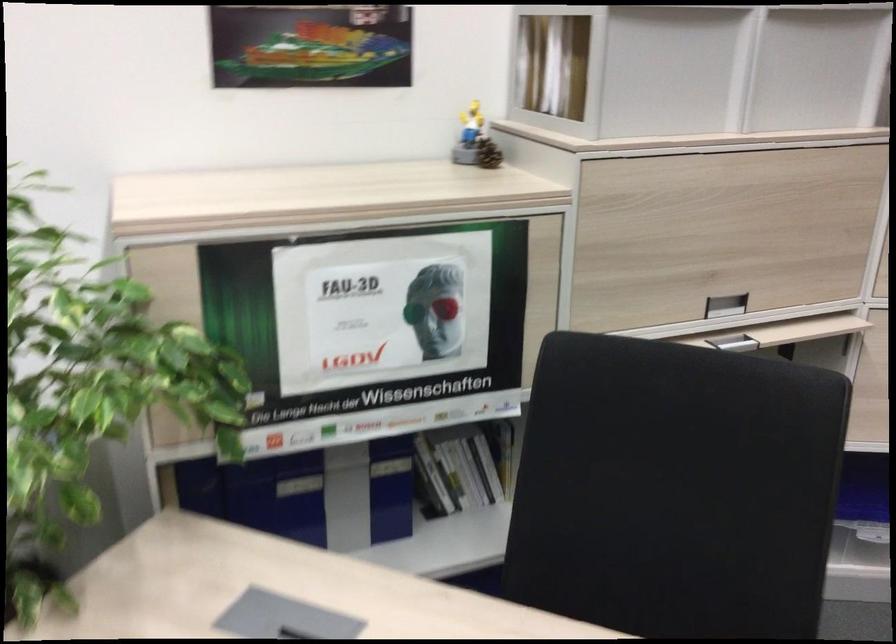
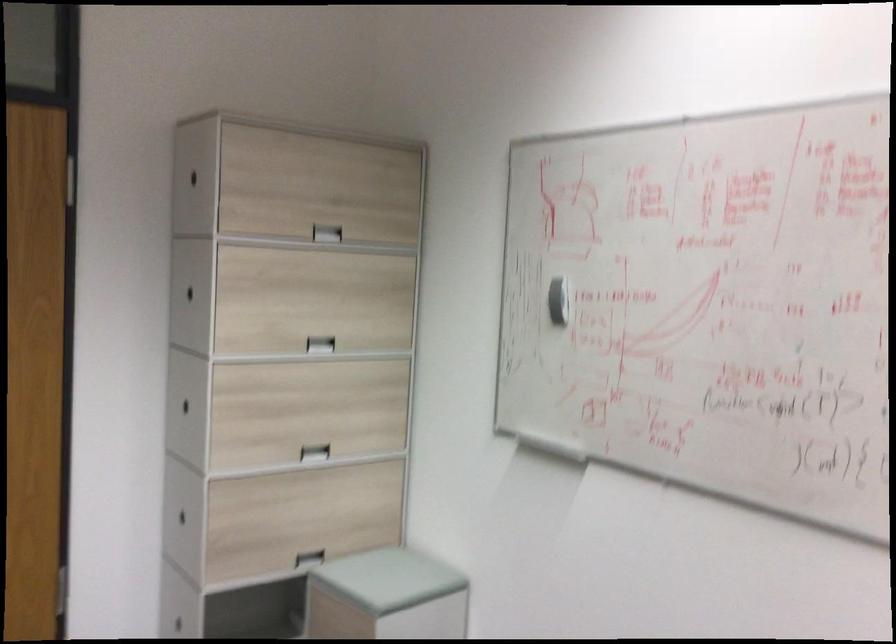
Question: Based on the continuous images, in which direction is the camera rotating? Reply with the corresponding letter.

Choices:
 (A) Left
 (B) Right
 (C) Up
 (D) Down

Answer: (B)